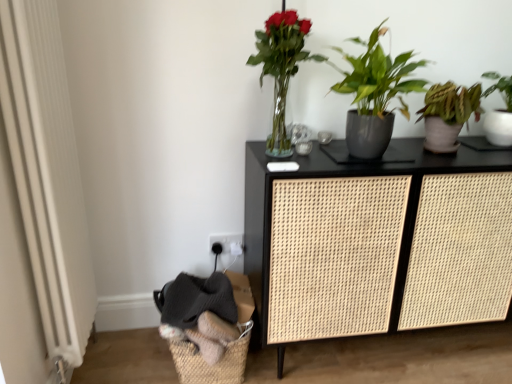
Question: Is matte gray pot at center right, which is counted as the 2th houseplant, starting from the left, positioned behind green matte plant at right, positioned as the first houseplant in right-to-left order?

Choices:
 (A) yes
 (B) no

Answer: (B)

Question: From the image's perspective, would you say matte gray pot at center right, which is counted as the 2th houseplant, starting from the left, is shown under green matte plant at right, positioned as the first houseplant in right-to-left order?

Choices:
 (A) no
 (B) yes

Answer: (B)

Question: Is matte gray pot at center right, which is counted as the 2th houseplant, starting from the left, next to green matte plant at right, which appears as the third houseplant when viewed from the left, and touching it?

Choices:
 (A) yes
 (B) no

Answer: (B)

Question: From the image's perspective, is matte gray pot at center right, which is counted as the 2th houseplant, starting from the left, located above green matte plant at right, which appears as the third houseplant when viewed from the left?

Choices:
 (A) yes
 (B) no

Answer: (B)

Question: Is matte gray pot at center right, which is counted as the 2th houseplant, starting from the left, to the left of green matte plant at right, positioned as the first houseplant in right-to-left order, from the viewer's perspective?

Choices:
 (A) no
 (B) yes

Answer: (B)

Question: Is matte gray pot at center right, positioned as the 2th houseplant in right-to-left order, closer to camera compared to green matte plant at right, which appears as the third houseplant when viewed from the left?

Choices:
 (A) no
 (B) yes

Answer: (B)

Question: From a real-world perspective, is white textured radiator at left located higher than green matte plant at right, positioned as the first houseplant in right-to-left order?

Choices:
 (A) yes
 (B) no

Answer: (B)

Question: Is white textured radiator at left looking in the opposite direction of green matte plant at right, positioned as the first houseplant in right-to-left order?

Choices:
 (A) no
 (B) yes

Answer: (A)

Question: Can you confirm if white textured radiator at left is thinner than green matte plant at right, positioned as the first houseplant in right-to-left order?

Choices:
 (A) no
 (B) yes

Answer: (B)

Question: Does white textured radiator at left have a larger size compared to green matte plant at right, which appears as the third houseplant when viewed from the left?

Choices:
 (A) yes
 (B) no

Answer: (A)

Question: Does white textured radiator at left lie behind green matte plant at right, which appears as the third houseplant when viewed from the left?

Choices:
 (A) no
 (B) yes

Answer: (A)

Question: Is white textured radiator at left with green matte plant at right, positioned as the first houseplant in right-to-left order?

Choices:
 (A) yes
 (B) no

Answer: (B)

Question: Could you tell me if woven natural basket at lower left is turned towards translucent glass vase at upper center, which ranks as the first houseplant in left-to-right order?

Choices:
 (A) yes
 (B) no

Answer: (B)